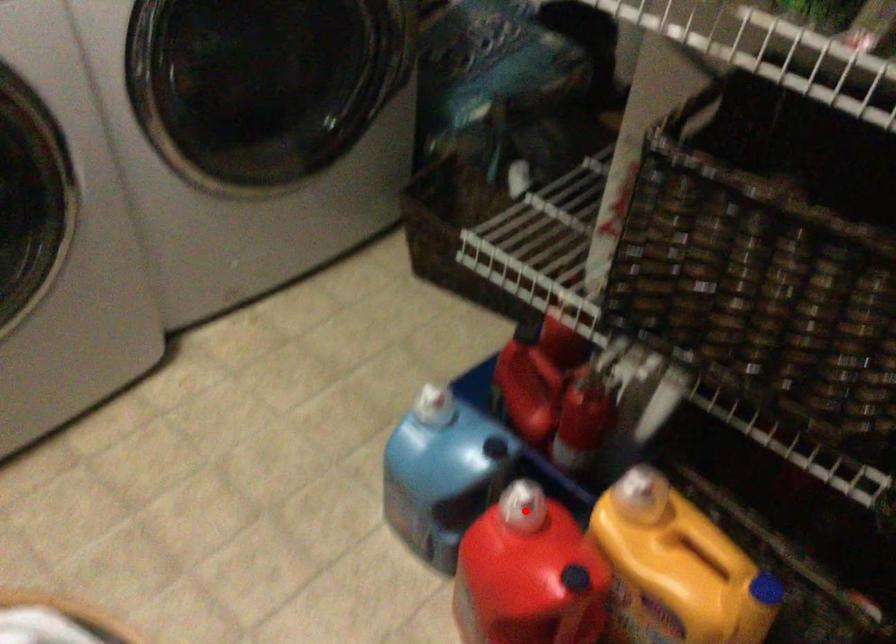
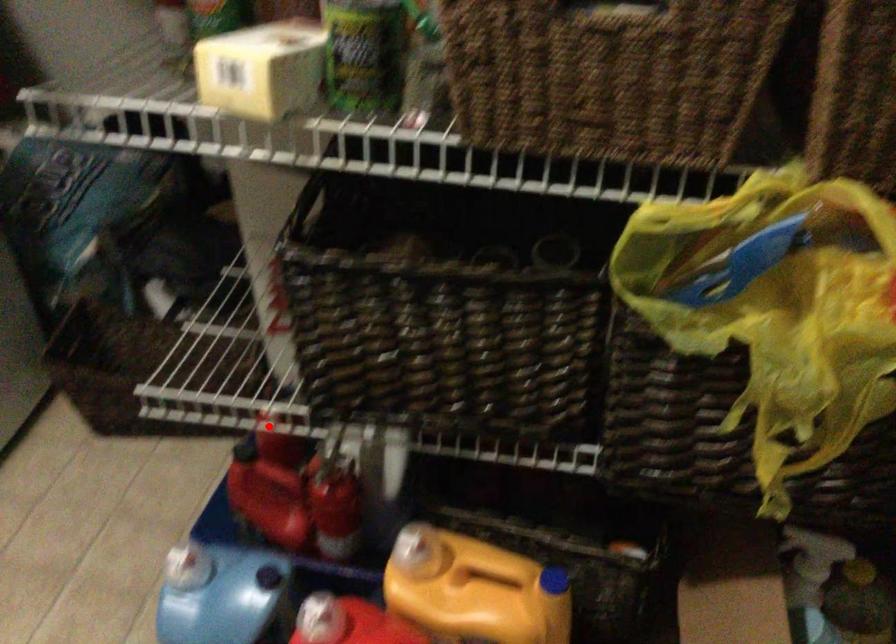
I am providing you with two images of the same scene from different viewpoints. A red point is marked on the first image and another point is marked on the second image. Is the red point in image1 aligned with the point shown in image2?

No